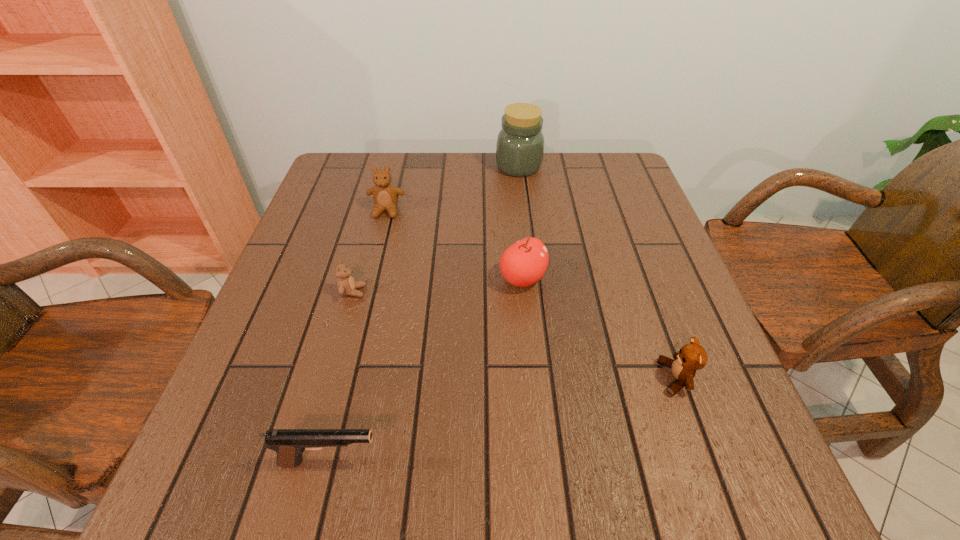
Identify the location of vacant space that satisfies the following two spatial constraints: 1. on the front-facing side of the farthest teddy bear; 2. on the left side of the apple. The image size is (960, 540). (370, 279).

Where is `vacant point that satisfies the following two spatial constraints: 1. on the front side of the jar; 2. on the front-facing side of the second nearest teddy bear`? The width and height of the screenshot is (960, 540). vacant point that satisfies the following two spatial constraints: 1. on the front side of the jar; 2. on the front-facing side of the second nearest teddy bear is located at coordinates (534, 292).

Where is `vacant area that satisfies the following two spatial constraints: 1. on the front-facing side of the farthest teddy bear; 2. on the front-facing side of the second nearest teddy bear`? This screenshot has height=540, width=960. vacant area that satisfies the following two spatial constraints: 1. on the front-facing side of the farthest teddy bear; 2. on the front-facing side of the second nearest teddy bear is located at coordinates (367, 292).